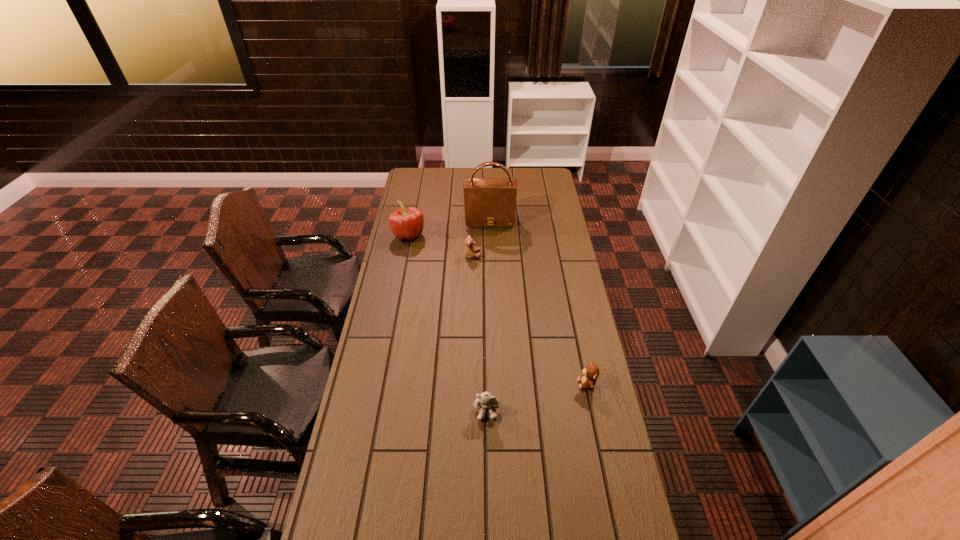
The width and height of the screenshot is (960, 540). Identify the location of vacant region located 0.340m on the face of the nearest teddy bear. (489, 536).

The height and width of the screenshot is (540, 960). I want to click on vacant space located 0.180m on the face of the rightmost teddy bear, so click(528, 384).

Where is `vacant space located 0.160m on the face of the rightmost teddy bear`? The height and width of the screenshot is (540, 960). vacant space located 0.160m on the face of the rightmost teddy bear is located at coordinates (534, 384).

Where is `free space located on the face of the rightmost teddy bear`? free space located on the face of the rightmost teddy bear is located at coordinates (503, 384).

Locate an element on the screen. The width and height of the screenshot is (960, 540). object located at the left edge is located at coordinates (406, 223).

This screenshot has height=540, width=960. What are the coordinates of `object that is at the right edge` in the screenshot? It's located at tap(590, 374).

Find the location of `free region at the far edge of the desktop`. free region at the far edge of the desktop is located at coordinates (460, 172).

The height and width of the screenshot is (540, 960). Find the location of `free spot at the left edge of the desktop`. free spot at the left edge of the desktop is located at coordinates (420, 203).

Where is `vacant region at the right edge`? Image resolution: width=960 pixels, height=540 pixels. vacant region at the right edge is located at coordinates (582, 299).

Where is `vacant area between the second farthest teddy bear and the tallest object`? vacant area between the second farthest teddy bear and the tallest object is located at coordinates (539, 302).